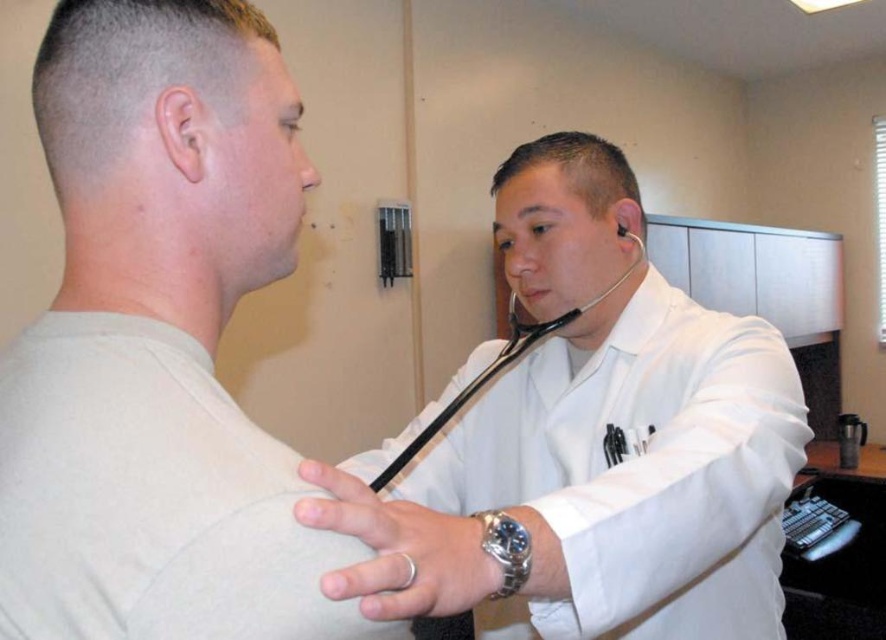
Question: Is white smooth stethoscope at upper right wider than pale skin at center?

Choices:
 (A) no
 (B) yes

Answer: (B)

Question: Can you confirm if pale skin at center is positioned to the right of black rubber stethoscope at upper center?

Choices:
 (A) yes
 (B) no

Answer: (B)

Question: Based on their relative distances, which object is farther from the black rubber stethoscope at upper center?

Choices:
 (A) white smooth stethoscope at upper right
 (B) pale skin at center

Answer: (B)

Question: Which object appears farthest from the camera in this image?

Choices:
 (A) black rubber stethoscope at upper center
 (B) white smooth stethoscope at upper right
 (C) pale skin at center

Answer: (A)

Question: Which point is closer to the camera?

Choices:
 (A) pale skin at center
 (B) white smooth stethoscope at upper right
 (C) black rubber stethoscope at upper center

Answer: (B)

Question: Does white smooth stethoscope at upper right have a larger size compared to pale skin at center?

Choices:
 (A) no
 (B) yes

Answer: (B)